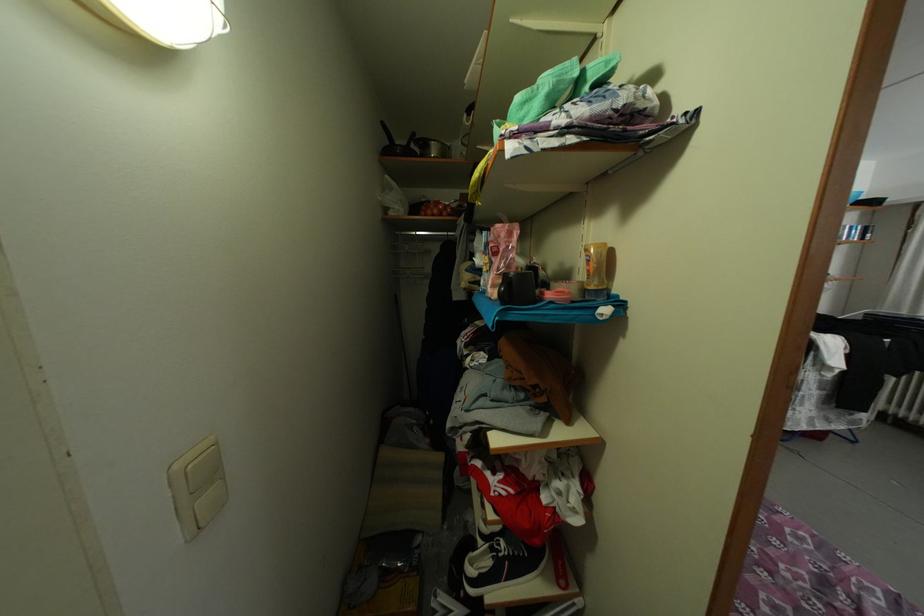
Where would you lift the pot handle? Please return your answer as a coordinate pair (x, y).

(386, 132)